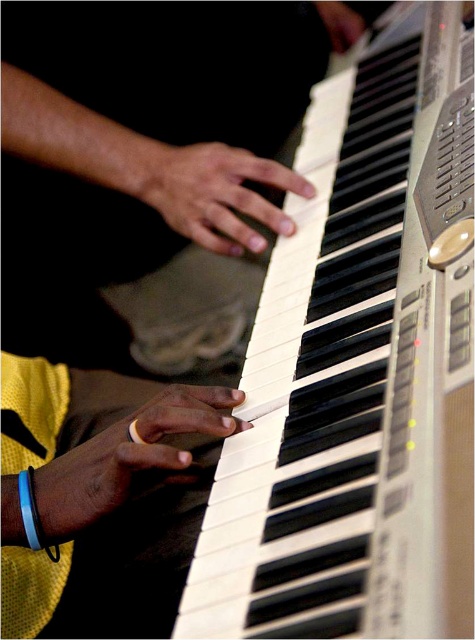
Question: Can you confirm if white plastic piano keys at center is positioned to the left of smooth skin hand at center?

Choices:
 (A) no
 (B) yes

Answer: (A)

Question: Among these objects, which one is farthest from the camera?

Choices:
 (A) smooth skin hand at center
 (B) yellow fabric wristband at upper left

Answer: (A)

Question: Which object is positioned farthest from the matte black hand at upper right?

Choices:
 (A) smooth yellow ring at lower left
 (B) yellow fabric wristband at upper left
 (C) white plastic piano keys at center

Answer: (B)

Question: Does white plastic piano keys at center have a lesser width compared to smooth yellow ring at lower left?

Choices:
 (A) no
 (B) yes

Answer: (A)

Question: Which point is closer to the camera taking this photo?

Choices:
 (A) (320, 204)
 (B) (19, 516)

Answer: (B)

Question: Does yellow fabric wristband at upper left appear on the left side of matte black hand at upper right?

Choices:
 (A) yes
 (B) no

Answer: (A)